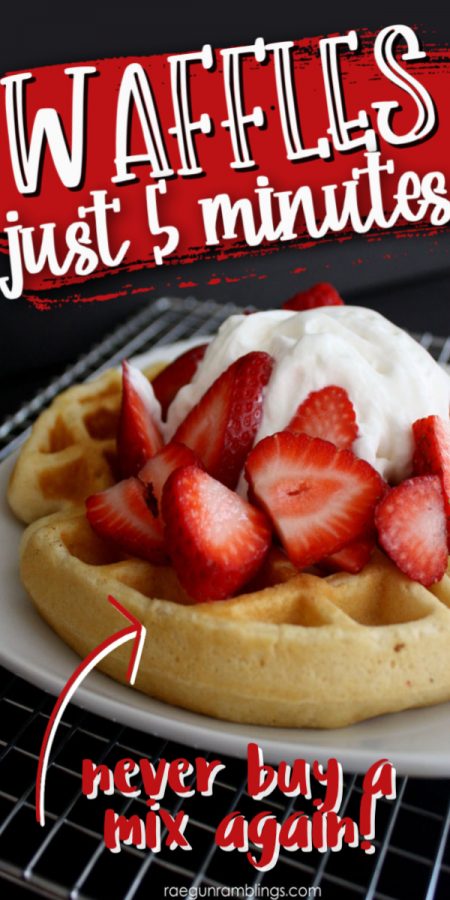
Find the location of `metal grid rack`. metal grid rack is located at coordinates (66, 815).